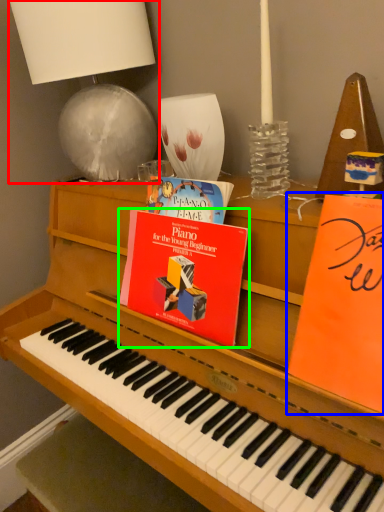
Question: Which object is positioned closest to table lamp (highlighted by a red box)? Select from paperback book (highlighted by a blue box) and paperback book (highlighted by a green box).

Choices:
 (A) paperback book
 (B) paperback book

Answer: (B)